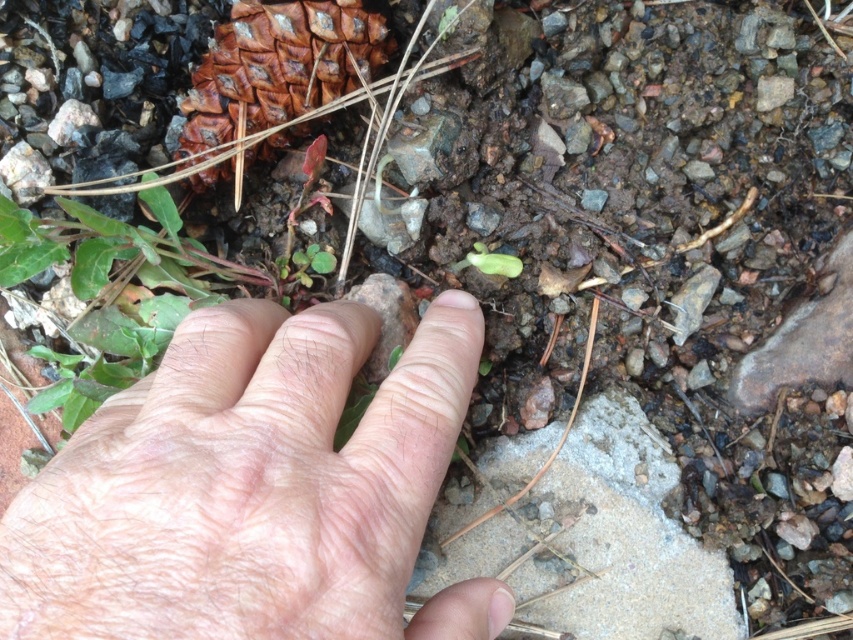
Looking at this image, based on the scene described, what is located at the coordinates point (253,490)?

The coordinates point (253,490) is where the pale skin at center is located.

Consider the image. Based on the scene description, where is the pale skin at center located in terms of its 2D coordinates?

The pale skin at center is located at the 2D coordinates of point (253,490).

Based on the photo, based on the scene, where is the gray concrete stone at center located in the image?

The gray concrete stone at center is located at the point with coordinates 0.845 in the x axis and 0.707 in the y axis.